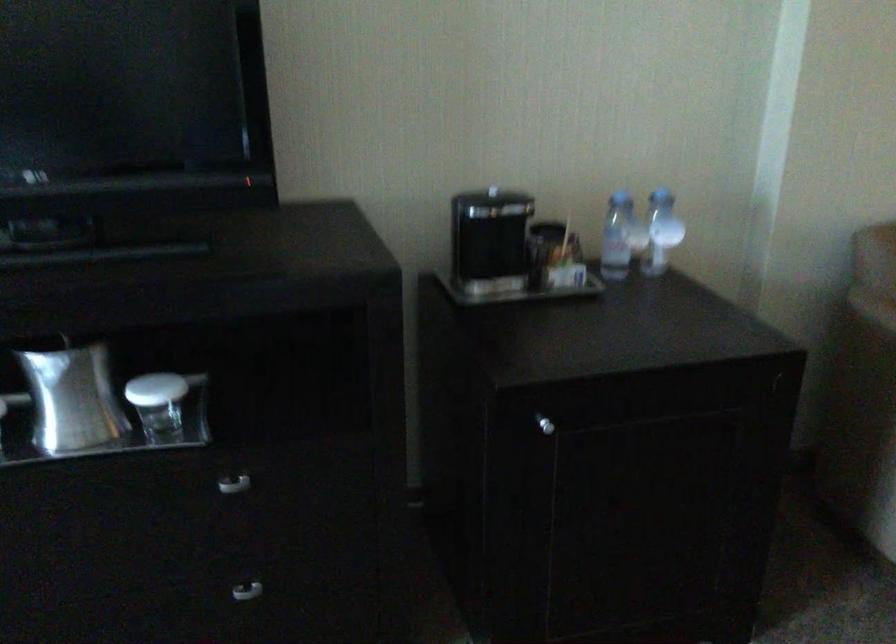
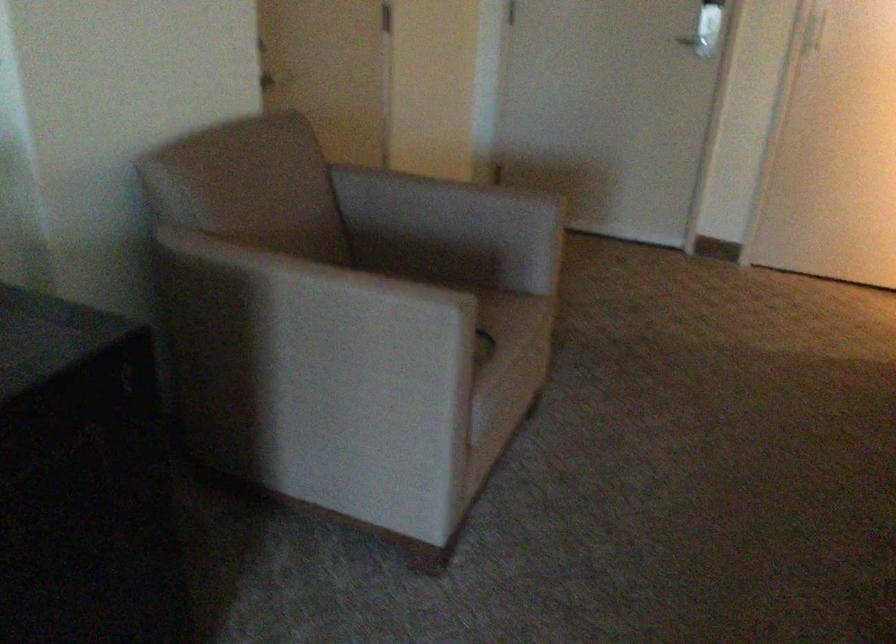
Question: The camera is either moving clockwise (left) or counter-clockwise (right) around the object. The first image is from the beginning of the video and the second image is from the end. Is the camera moving left or right when shooting the video?

Choices:
 (A) Left
 (B) Right

Answer: (A)